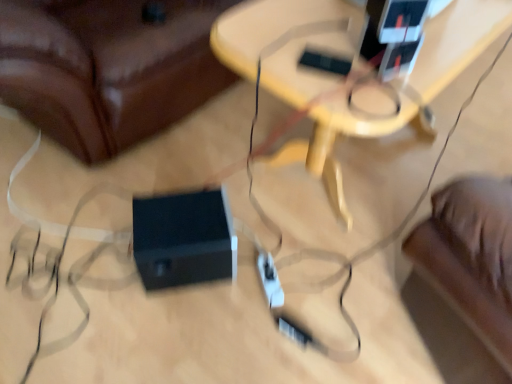
Question: Is black plastic speaker at lower center bigger than black plastic speaker at lower center?

Choices:
 (A) yes
 (B) no

Answer: (A)

Question: Is black plastic speaker at lower center aimed at black plastic speaker at lower center?

Choices:
 (A) no
 (B) yes

Answer: (B)

Question: Does black plastic speaker at lower center have a greater height compared to black plastic speaker at lower center?

Choices:
 (A) no
 (B) yes

Answer: (B)

Question: From a real-world perspective, is black plastic speaker at lower center physically below black plastic speaker at lower center?

Choices:
 (A) yes
 (B) no

Answer: (B)

Question: Is black plastic speaker at lower center further to camera compared to black plastic speaker at lower center?

Choices:
 (A) yes
 (B) no

Answer: (B)

Question: Is wooden table at center wider or thinner than black plastic speaker at lower center?

Choices:
 (A) thin
 (B) wide

Answer: (A)

Question: In the image, is wooden table at center positioned in front of or behind black plastic speaker at lower center?

Choices:
 (A) behind
 (B) front

Answer: (A)

Question: Visually, is wooden table at center positioned to the left or to the right of black plastic speaker at lower center?

Choices:
 (A) right
 (B) left

Answer: (A)

Question: From the image's perspective, relative to black plastic speaker at lower center, is wooden table at center above or below?

Choices:
 (A) above
 (B) below

Answer: (B)

Question: Considering their positions, is black plastic speaker at lower center located in front of or behind black plastic speaker at lower center?

Choices:
 (A) front
 (B) behind

Answer: (A)

Question: Visually, is black plastic speaker at lower center positioned to the left or to the right of black plastic speaker at lower center?

Choices:
 (A) right
 (B) left

Answer: (B)

Question: Looking at their shapes, would you say black plastic speaker at lower center is wider or thinner than black plastic speaker at lower center?

Choices:
 (A) thin
 (B) wide

Answer: (B)

Question: Would you say black plastic speaker at lower center is inside or outside black plastic speaker at lower center?

Choices:
 (A) outside
 (B) inside

Answer: (A)

Question: In terms of size, does black plastic speaker at lower center appear bigger or smaller than black plastic speaker at lower center?

Choices:
 (A) small
 (B) big

Answer: (A)

Question: Looking at their shapes, would you say black plastic speaker at lower center is wider or thinner than black plastic speaker at lower center?

Choices:
 (A) wide
 (B) thin

Answer: (B)